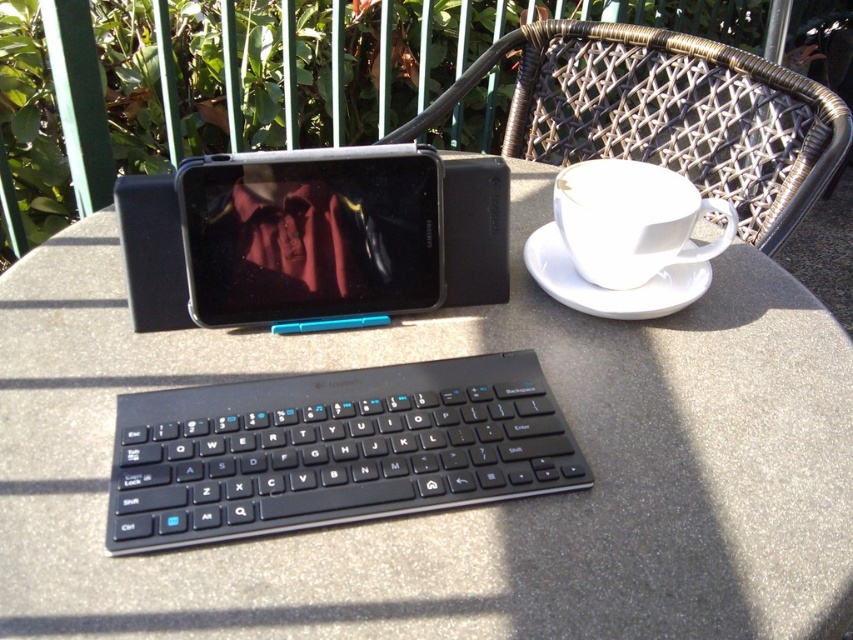
How much distance is there between black plastic tablet at upper center and white ceramic cup at upper right?

black plastic tablet at upper center is 7.09 inches from white ceramic cup at upper right.

Where is `black plastic tablet at upper center`? black plastic tablet at upper center is located at coordinates (311, 234).

Locate an element on the screen. Image resolution: width=853 pixels, height=640 pixels. black plastic tablet at upper center is located at coordinates (311, 234).

The width and height of the screenshot is (853, 640). What do you see at coordinates (334, 449) in the screenshot?
I see `black plastic keyboard at center` at bounding box center [334, 449].

Find the location of `black plastic keyboard at center`. black plastic keyboard at center is located at coordinates pos(334,449).

Locate an element on the screen. Image resolution: width=853 pixels, height=640 pixels. black plastic keyboard at center is located at coordinates (334, 449).

Does black plastic keyboard at center appear over white ceramic saucer at right?

No, black plastic keyboard at center is not above white ceramic saucer at right.

Find the location of a particular element. black plastic keyboard at center is located at coordinates (334, 449).